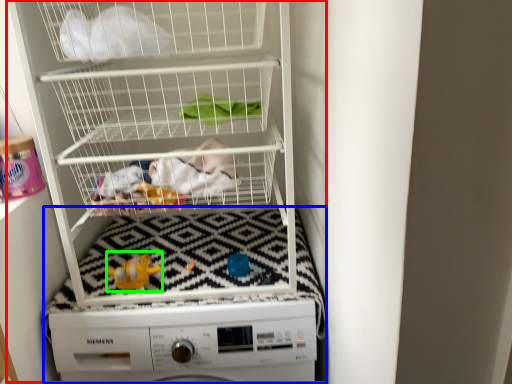
Question: Which object is positioned closest to bunk bed (highlighted by a red box)? Select from machine (highlighted by a blue box) and toy (highlighted by a green box).

Choices:
 (A) machine
 (B) toy

Answer: (A)